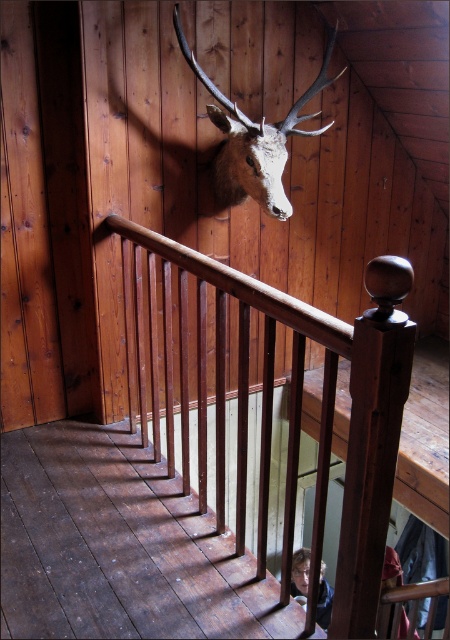
From the picture: You are an interior designer assessing the space. The wooden stair at lower center and the matte brown deer head at upper center are both in view. Which object occupies more space in the visual field?

The wooden stair at lower center occupies more space in the visual field because it has a larger size compared to the matte brown deer head at upper center.